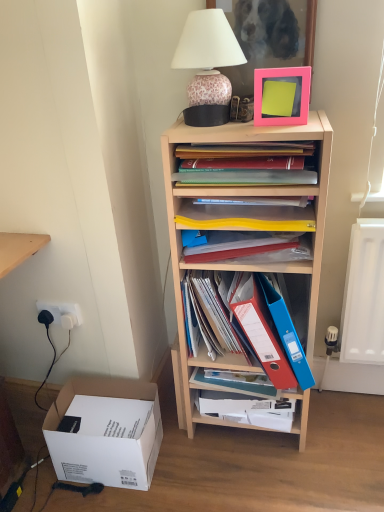
Locate an element on the screen. This screenshot has height=512, width=384. free space in front of pink matte picture frame at upper center, marked as the second picture frame in a top-to-bottom arrangement is located at coordinates (297, 127).